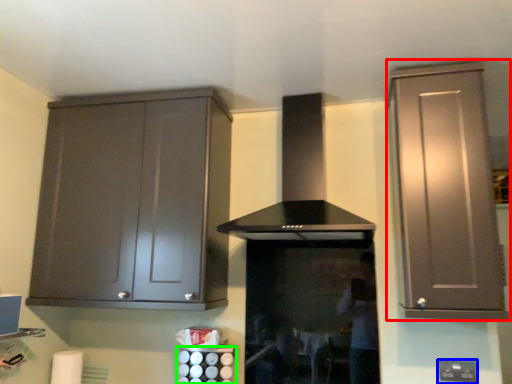
Question: Estimate the real-world distances between objects in this image. Which object is farther from cabinetry (highlighted by a red box), electric outlet (highlighted by a blue box) or appliance (highlighted by a green box)?

Choices:
 (A) electric outlet
 (B) appliance

Answer: (B)